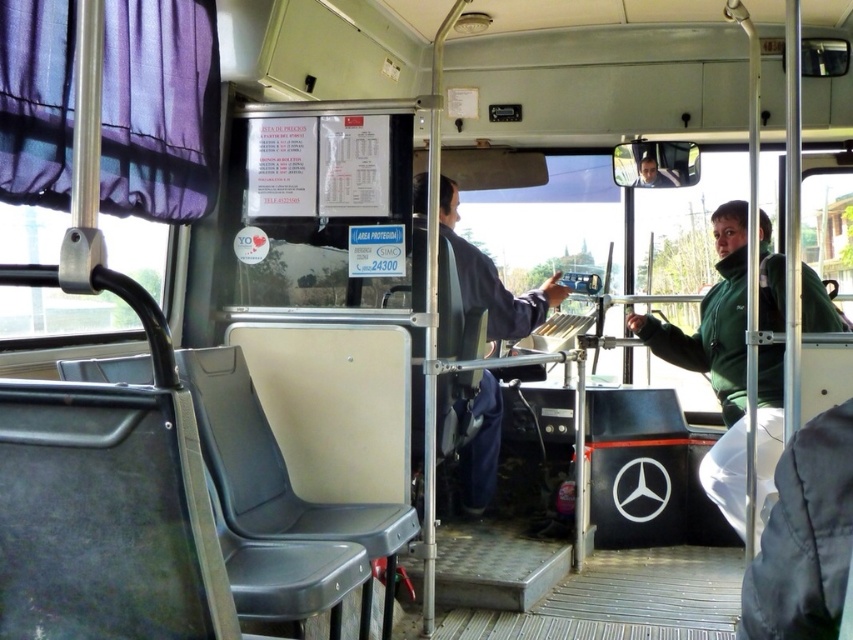
Question: Is green matte jacket at right to the right of dark blue fabric jacket at center from the viewer's perspective?

Choices:
 (A) no
 (B) yes

Answer: (B)

Question: Which of the following is the farthest from the observer?

Choices:
 (A) green matte jacket at right
 (B) dark blue fabric jacket at center

Answer: (B)

Question: Is green matte jacket at right smaller than dark blue fabric jacket at center?

Choices:
 (A) yes
 (B) no

Answer: (A)

Question: Which point appears closest to the camera in this image?

Choices:
 (A) (670, 326)
 (B) (485, 472)

Answer: (A)

Question: Does green matte jacket at right appear over dark blue fabric jacket at center?

Choices:
 (A) no
 (B) yes

Answer: (A)